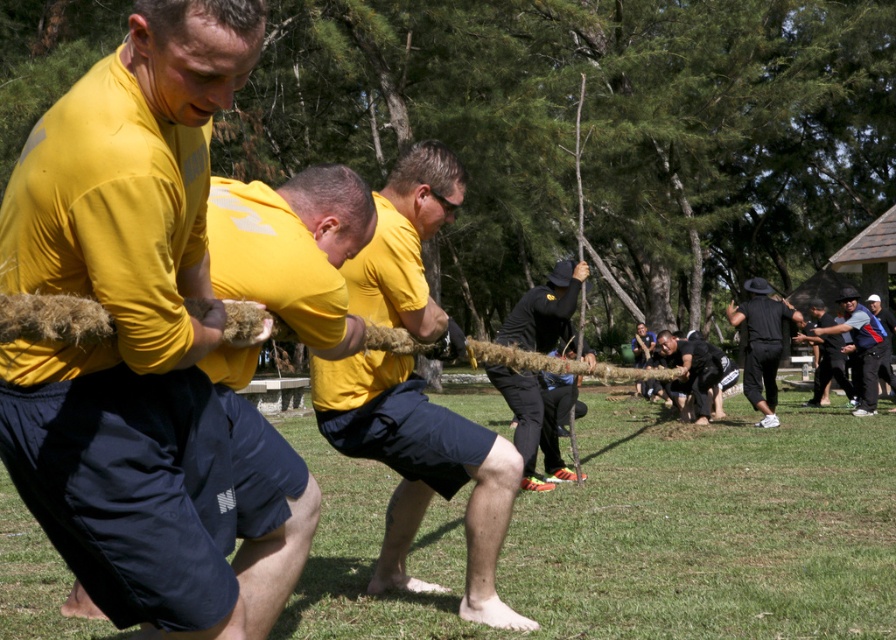
Is matte yellow shirt at center to the right of yellow matte shirt at center from the viewer's perspective?

In fact, matte yellow shirt at center is to the left of yellow matte shirt at center.

Is matte yellow shirt at center positioned before yellow matte shirt at center?

Yes, matte yellow shirt at center is closer to the viewer.

Locate an element on the screen. matte yellow shirt at center is located at coordinates (135, 332).

Is black matte baseball cap at center below dark blue jeans at center?

Yes, black matte baseball cap at center is below dark blue jeans at center.

This screenshot has width=896, height=640. Describe the element at coordinates (545, 310) in the screenshot. I see `black matte baseball cap at center` at that location.

The height and width of the screenshot is (640, 896). I want to click on black matte baseball cap at center, so click(x=545, y=310).

The width and height of the screenshot is (896, 640). Identify the location of black matte baseball cap at center. (545, 310).

Is black matte baseball cap at center positioned behind black matte hat at upper right?

No.

Between point (538, 404) and point (760, 317), which one is positioned behind?

Positioned behind is point (760, 317).

Where is `black matte baseball cap at center`? Image resolution: width=896 pixels, height=640 pixels. black matte baseball cap at center is located at coordinates click(x=545, y=310).